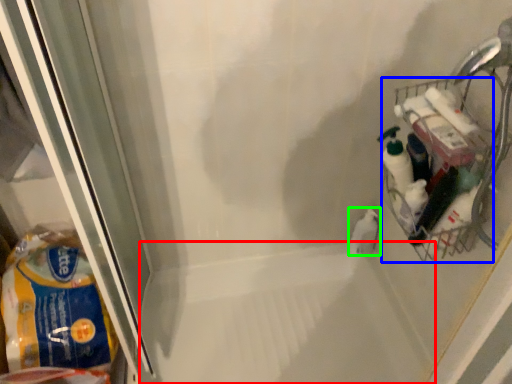
Question: Estimate the real-world distances between objects in this image. Which object is closer to bath (highlighted by a red box), basket (highlighted by a blue box) or cleaning product (highlighted by a green box)?

Choices:
 (A) basket
 (B) cleaning product

Answer: (B)